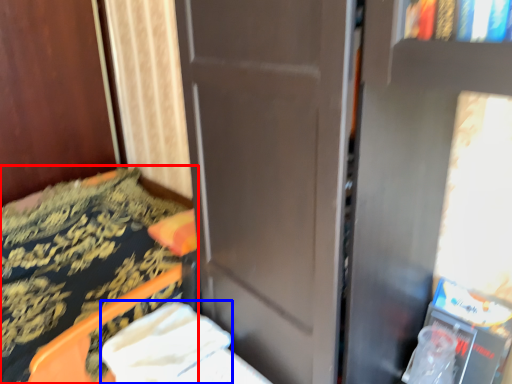
Question: Which object appears closest to the camera in this image, furniture (highlighted by a red box) or sheet (highlighted by a blue box)?

Choices:
 (A) furniture
 (B) sheet

Answer: (A)